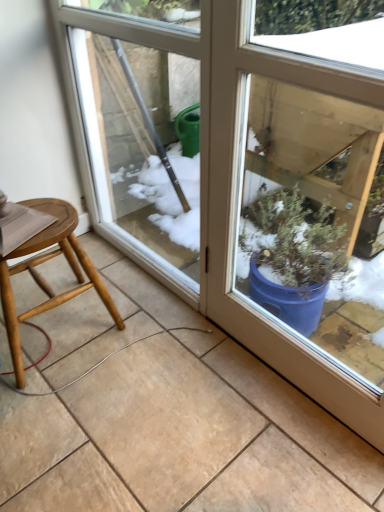
Image resolution: width=384 pixels, height=512 pixels. I want to click on vacant area in front of light wood stool at lower left, so click(65, 407).